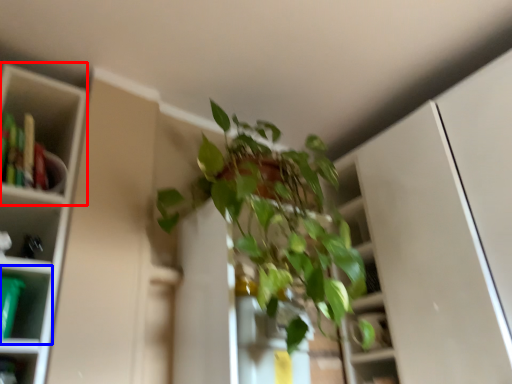
Question: Which object appears closest to the camera in this image, cabinet (highlighted by a red box) or shelf (highlighted by a blue box)?

Choices:
 (A) cabinet
 (B) shelf

Answer: (B)